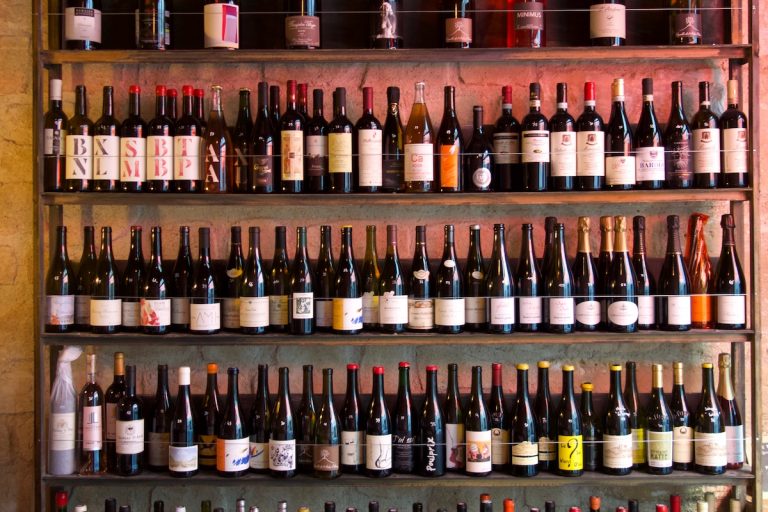
Image resolution: width=768 pixels, height=512 pixels. I want to click on wooden shelves, so click(366, 53), click(412, 198), click(447, 335), click(471, 479).